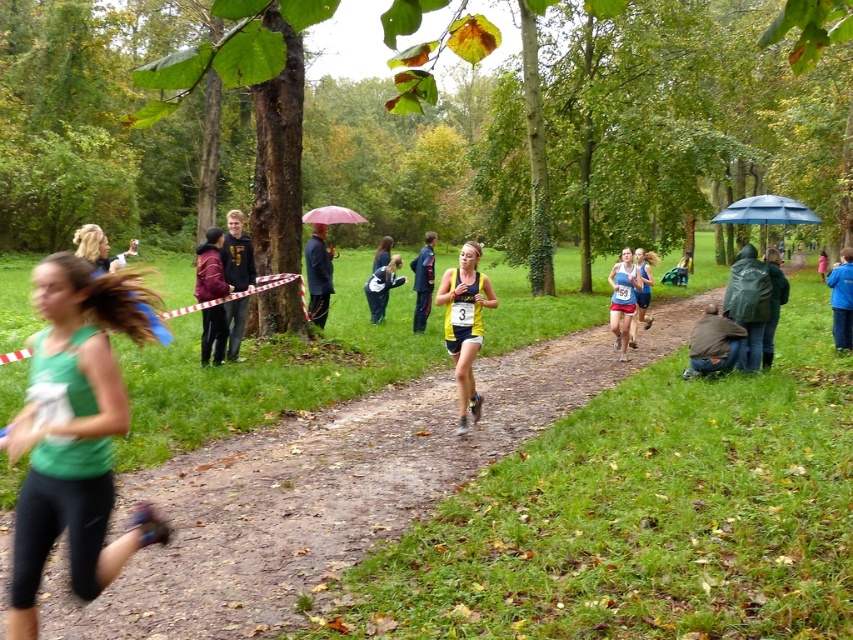
Question: Is yellow-green jersey at center bigger than dark blue jeans at center?

Choices:
 (A) yes
 (B) no

Answer: (A)

Question: Can you confirm if green fabric tank top at left is positioned to the right of brown leather jacket at lower right?

Choices:
 (A) no
 (B) yes

Answer: (A)

Question: Does dark blue jeans at center have a lesser width compared to blue matte umbrella at upper right?

Choices:
 (A) yes
 (B) no

Answer: (A)

Question: Which point appears farthest from the camera in this image?

Choices:
 (A) (90, 403)
 (B) (421, 285)

Answer: (B)

Question: Which point is farther to the camera?

Choices:
 (A) (469, 320)
 (B) (73, 445)
 (C) (238, 324)

Answer: (C)

Question: Which object is farther from the camera taking this photo?

Choices:
 (A) yellow-green jersey at center
 (B) pink fabric umbrella at center
 (C) dark blue jacket at center

Answer: (C)